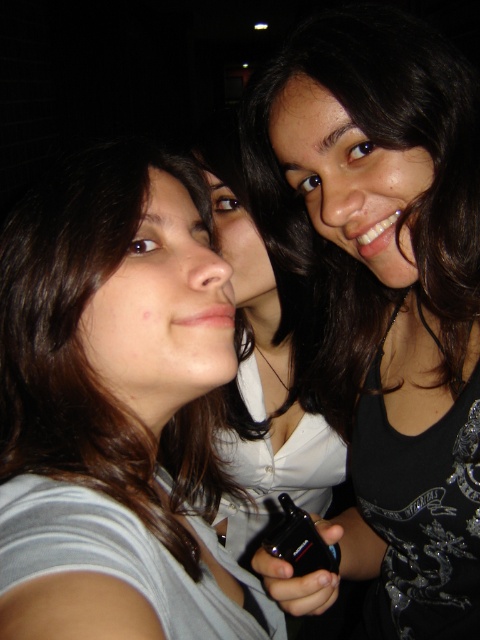
Does gray striped shirt at left have a lesser width compared to black glossy phone at center?

No, gray striped shirt at left is not thinner than black glossy phone at center.

Is gray striped shirt at left wider than black glossy phone at center?

Yes, gray striped shirt at left is wider than black glossy phone at center.

Measure the distance between gray striped shirt at left and camera.

gray striped shirt at left and camera are 12.65 inches apart from each other.

Image resolution: width=480 pixels, height=640 pixels. I want to click on gray striped shirt at left, so click(115, 410).

Which is below, gray striped shirt at left or black plastic phone at center?

Positioned lower is black plastic phone at center.

Is point (118, 456) closer to camera compared to point (303, 522)?

Yes, point (118, 456) is closer to viewer.

Between point (111, 448) and point (319, 554), which one is positioned in front?

Positioned in front is point (111, 448).

Locate an element on the screen. gray striped shirt at left is located at coordinates (115, 410).

Consider the image. Does black glossy phone at center have a smaller size compared to black plastic phone at center?

No.

Does black glossy phone at center come behind black plastic phone at center?

No.

Is point (433, 477) behind point (336, 557)?

No, it is not.

You are a GUI agent. You are given a task and a screenshot of the screen. Output one action in this format:
    pyautogui.click(x=<x>, y=<y>)
    Task: Click on the black glossy phone at center
    The width and height of the screenshot is (480, 640).
    Given the screenshot: What is the action you would take?
    pyautogui.click(x=389, y=294)